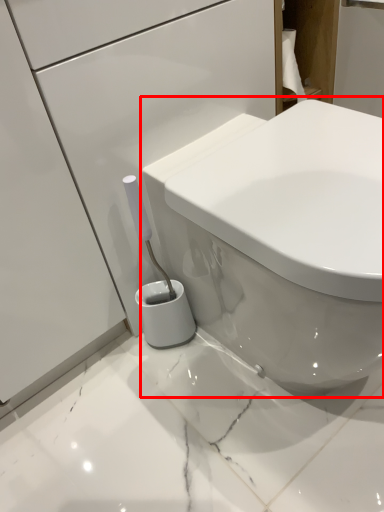
Question: From the image's perspective, what is the correct spatial positioning of toilet (annotated by the red box) in reference to cabinetry?

Choices:
 (A) above
 (B) below

Answer: (B)